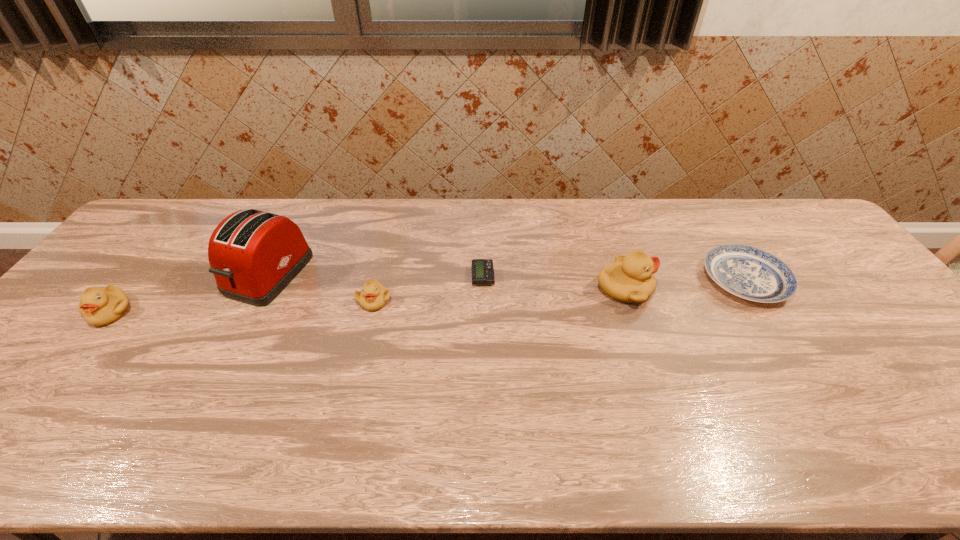
This screenshot has height=540, width=960. Find the location of `vacant region between the fifth tallest object and the leftmost object`. vacant region between the fifth tallest object and the leftmost object is located at coordinates (428, 296).

Identify which object is located as the third nearest to the fifth object from right to left. Please provide its 2D coordinates. Your answer should be formatted as a tuple, i.e. [(x, y)], where the tuple contains the x and y coordinates of a point satisfying the conditions above.

[(482, 269)]

The height and width of the screenshot is (540, 960). What are the coordinates of `the third closest object relative to the tallest duckling` in the screenshot? It's located at (373, 296).

Identify which duckling is the second closest to the leftmost object. Please provide its 2D coordinates. Your answer should be formatted as a tuple, i.e. [(x, y)], where the tuple contains the x and y coordinates of a point satisfying the conditions above.

[(630, 279)]

At what (x,y) coordinates should I click in order to perform the action: click on duckling that stands as the second closest to the fifth object from right to left. Please return your answer as a coordinate pair (x, y). Looking at the image, I should click on (99, 307).

Image resolution: width=960 pixels, height=540 pixels. Find the location of `vacant space that satisfies the following two spatial constraints: 1. on the front side of the tallest object; 2. on the right side of the rightmost object`. vacant space that satisfies the following two spatial constraints: 1. on the front side of the tallest object; 2. on the right side of the rightmost object is located at coordinates (266, 280).